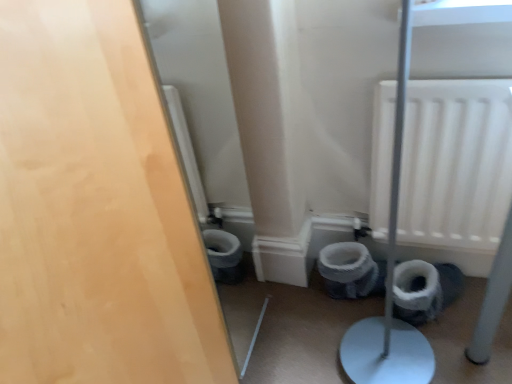
Question: From a real-world perspective, is matte wood door at left under white matte radiator at upper right?

Choices:
 (A) no
 (B) yes

Answer: (A)

Question: Is matte wood door at left touching white matte radiator at upper right?

Choices:
 (A) no
 (B) yes

Answer: (A)

Question: Is white matte radiator at upper right inside matte wood door at left?

Choices:
 (A) yes
 (B) no

Answer: (B)

Question: From a real-world perspective, is matte wood door at left positioned over white matte radiator at upper right based on gravity?

Choices:
 (A) yes
 (B) no

Answer: (A)

Question: From the image's perspective, is matte wood door at left located beneath white matte radiator at upper right?

Choices:
 (A) yes
 (B) no

Answer: (A)

Question: In terms of size, does white matte radiator at upper right appear bigger or smaller than matte wood door at left?

Choices:
 (A) small
 (B) big

Answer: (A)

Question: Looking at their shapes, would you say white matte radiator at upper right is wider or thinner than matte wood door at left?

Choices:
 (A) thin
 (B) wide

Answer: (B)

Question: Is white matte radiator at upper right in front of or behind matte wood door at left in the image?

Choices:
 (A) behind
 (B) front

Answer: (A)

Question: From their relative heights in the image, would you say white matte radiator at upper right is taller or shorter than matte wood door at left?

Choices:
 (A) short
 (B) tall

Answer: (A)

Question: From the image's perspective, is white matte radiator at upper right above or below white fabric toilet bowl at lower center?

Choices:
 (A) below
 (B) above

Answer: (B)

Question: Visually, is white matte radiator at upper right positioned to the left or to the right of white fabric toilet bowl at lower center?

Choices:
 (A) left
 (B) right

Answer: (B)

Question: From a real-world perspective, relative to white fabric toilet bowl at lower center, is white matte radiator at upper right vertically above or below?

Choices:
 (A) above
 (B) below

Answer: (A)

Question: Relative to white fabric toilet bowl at lower center, is white matte radiator at upper right in front or behind?

Choices:
 (A) front
 (B) behind

Answer: (A)

Question: From the image's perspective, relative to matte wood door at left, is white fabric toilet bowl at lower center above or below?

Choices:
 (A) below
 (B) above

Answer: (A)

Question: Do you think white fabric toilet bowl at lower center is within matte wood door at left, or outside of it?

Choices:
 (A) outside
 (B) inside

Answer: (A)